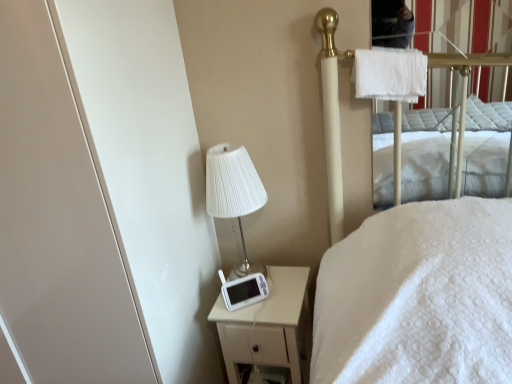
Question: From the image's perspective, is white pleated fabric lampshade at upper left positioned above or below white matte nightstand at lower right?

Choices:
 (A) above
 (B) below

Answer: (A)

Question: From a real-world perspective, is white pleated fabric lampshade at upper left above or below white matte nightstand at lower right?

Choices:
 (A) below
 (B) above

Answer: (B)

Question: Which object is the closest to the white pleated fabric lampshade at upper left?

Choices:
 (A) white glossy screen door at left
 (B) white fluffy towel at upper right
 (C) white matte nightstand at lower right

Answer: (C)

Question: Estimate the real-world distances between objects in this image. Which object is closer to the white pleated fabric lampshade at upper left?

Choices:
 (A) white glossy screen door at left
 (B) white matte nightstand at lower right
 (C) white fluffy towel at upper right

Answer: (B)